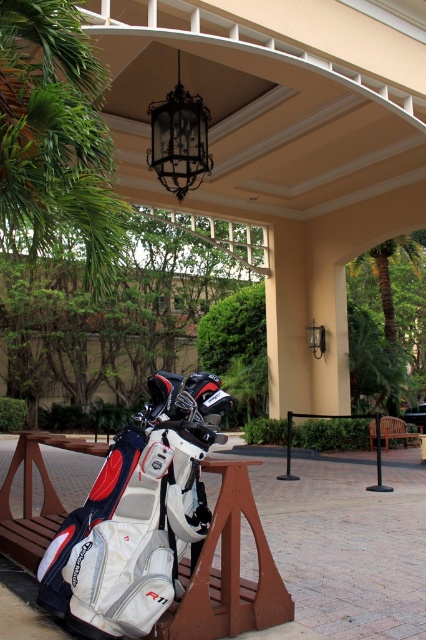
Question: Estimate the real-world distances between objects in this image. Which object is closer to the brown wooden park bench at lower right?

Choices:
 (A) white fabric park bench at lower left
 (B) green leafy palm tree at upper left

Answer: (A)

Question: Which object is the closest to the white fabric park bench at lower left?

Choices:
 (A) brown wooden park bench at lower right
 (B) green leafy palm tree at upper left

Answer: (B)

Question: Where is green leafy palm tree at upper left located in relation to white fabric park bench at lower left in the image?

Choices:
 (A) right
 (B) left

Answer: (A)

Question: Considering the relative positions of green leafy palm tree at upper left and brown wooden park bench at lower right in the image provided, where is green leafy palm tree at upper left located with respect to brown wooden park bench at lower right?

Choices:
 (A) below
 (B) above

Answer: (B)

Question: Can you confirm if green leafy palm tree at upper left is positioned to the left of brown wooden park bench at lower right?

Choices:
 (A) yes
 (B) no

Answer: (A)

Question: Among these points, which one is farthest from the camera?

Choices:
 (A) [14, 51]
 (B) [386, 428]
 (C) [23, 563]

Answer: (B)